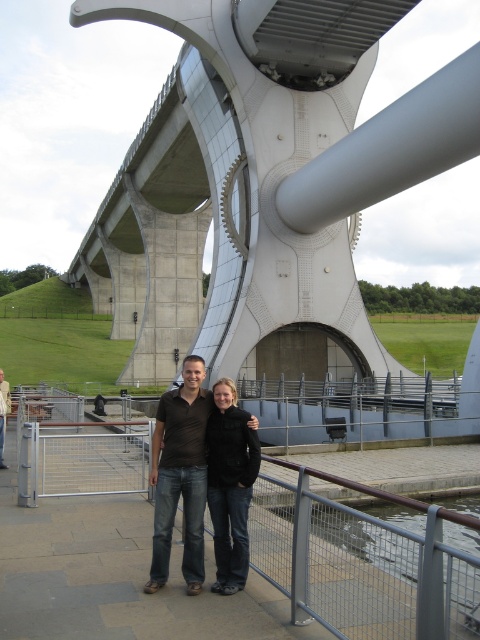
Question: Where is brown cotton shirt at center located in relation to brown shirt at center in the image?

Choices:
 (A) above
 (B) below

Answer: (B)

Question: Is black leather jacket at center closer to the viewer compared to brown shirt at center?

Choices:
 (A) no
 (B) yes

Answer: (B)

Question: Is metallic gray bridge at center in front of black leather jacket at center?

Choices:
 (A) no
 (B) yes

Answer: (A)

Question: Which of these objects is positioned farthest from the black leather jacket at center?

Choices:
 (A) brown cotton shirt at center
 (B) brown shirt at center
 (C) metallic gray bridge at center

Answer: (C)

Question: Among these points, which one is nearest to the camera?

Choices:
 (A) (210, 502)
 (B) (2, 451)
 (C) (153, 576)
 (D) (398, 188)

Answer: (C)

Question: Which of the following is the closest to the observer?

Choices:
 (A) brown cotton shirt at center
 (B) brown shirt at center
 (C) black leather jacket at center
 (D) metallic gray bridge at center

Answer: (A)